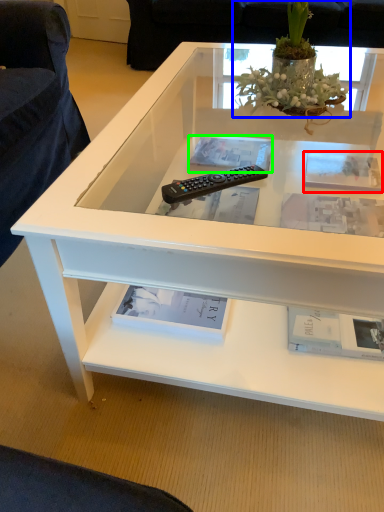
Question: Which object is the farthest from square (highlighted by a red box)? Choose among these: houseplant (highlighted by a blue box) or book (highlighted by a green box).

Choices:
 (A) houseplant
 (B) book

Answer: (A)